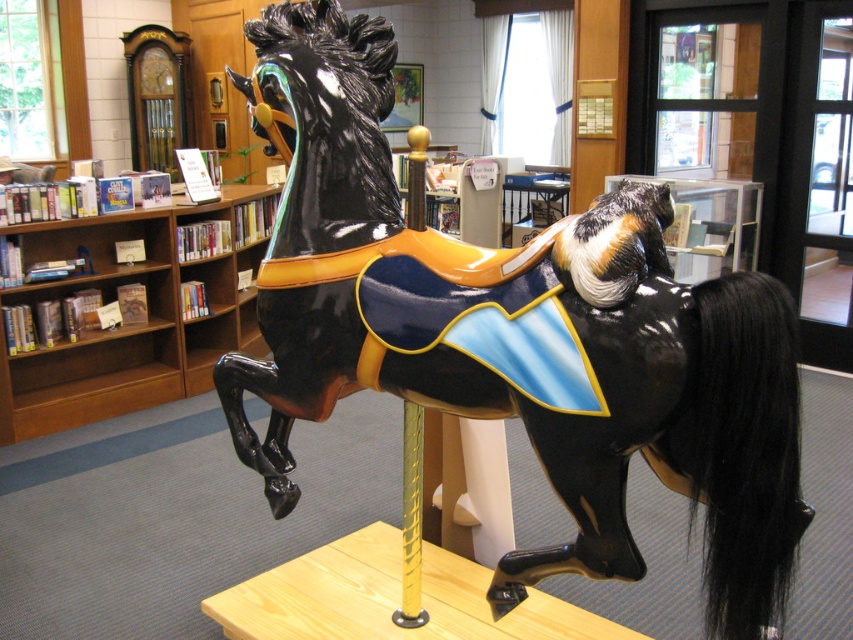
Question: Does glossy black horse at center appear under wooden bookshelf at left?

Choices:
 (A) no
 (B) yes

Answer: (B)

Question: Which point is farther from the camera taking this photo?

Choices:
 (A) 367,246
 (B) 166,308

Answer: (B)

Question: Observing the image, what is the correct spatial positioning of glossy black horse at center in reference to wooden bookshelf at left?

Choices:
 (A) below
 (B) above

Answer: (A)

Question: Considering the relative positions of glossy black horse at center and wooden bookshelf at left in the image provided, where is glossy black horse at center located with respect to wooden bookshelf at left?

Choices:
 (A) above
 (B) below

Answer: (B)

Question: Among these objects, which one is nearest to the camera?

Choices:
 (A) wooden bookshelf at left
 (B) glossy black horse at center

Answer: (B)